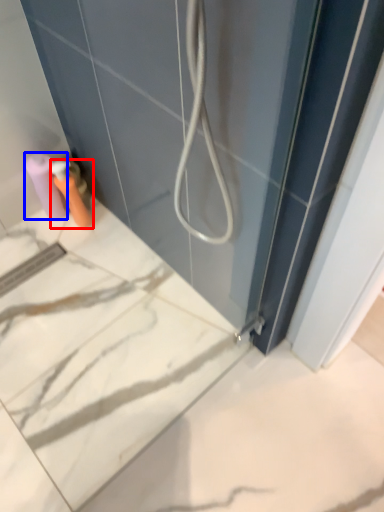
Question: Which of the following is the farthest to the observer, toiletry (highlighted by a red box) or toilet paper (highlighted by a blue box)?

Choices:
 (A) toiletry
 (B) toilet paper

Answer: (B)